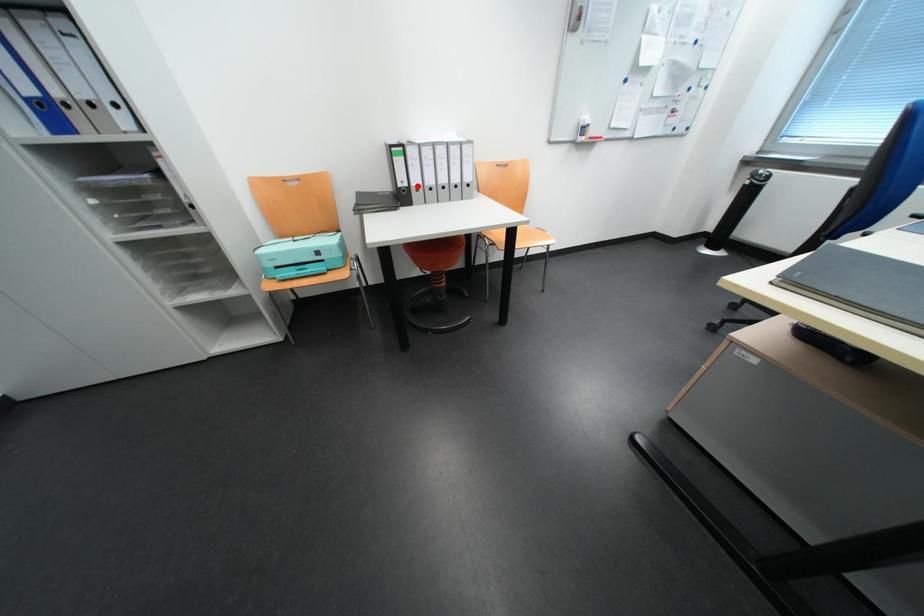
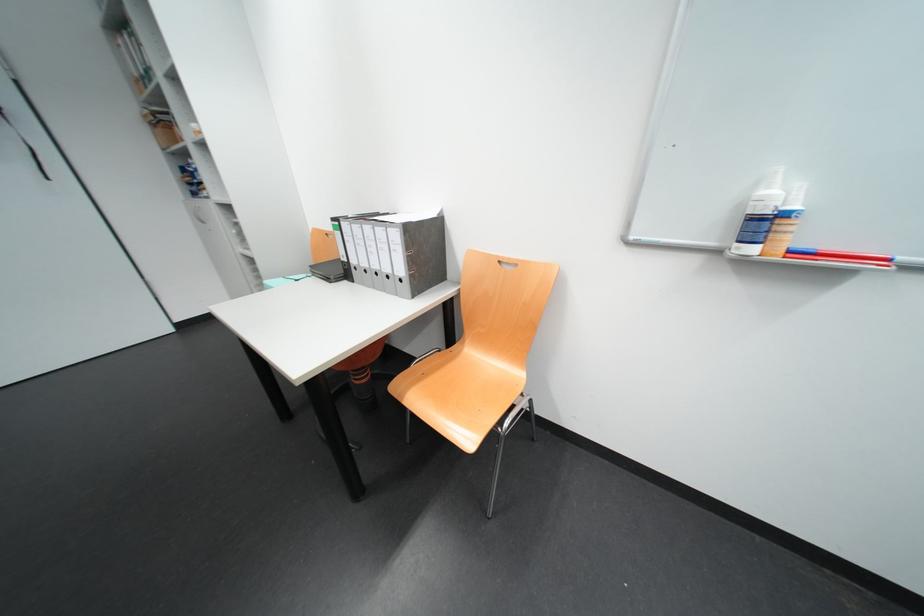
Question: I am providing you with two images of the same scene from different viewpoints. In image1, a red point is highlighted. Considering the same 3D point in image2, which of the following is correct?

Choices:
 (A) It is closer
 (B) It is farther

Answer: (B)